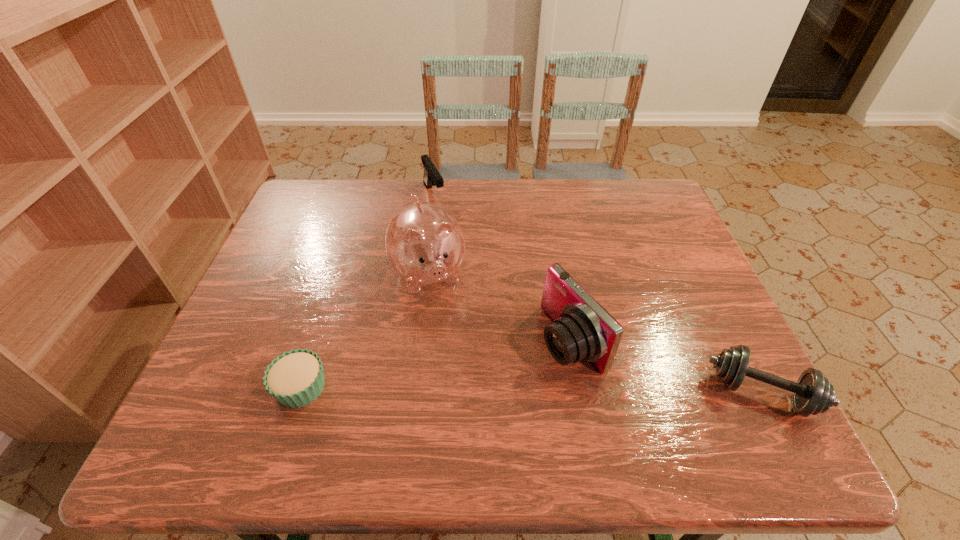
Identify the location of dumbbell present at the near edge. The image size is (960, 540). (x=812, y=393).

This screenshot has height=540, width=960. I want to click on camera that is at the near edge, so click(582, 330).

The image size is (960, 540). What are the coordinates of `object that is at the left edge` in the screenshot? It's located at (296, 378).

I want to click on object located in the right edge section of the desktop, so click(x=812, y=393).

Where is `object present at the near left corner`? object present at the near left corner is located at coordinates (296, 378).

The height and width of the screenshot is (540, 960). I want to click on object situated at the near right corner, so click(x=812, y=393).

In the image, there is a desktop. Where is `free space at the far edge`? free space at the far edge is located at coordinates (385, 198).

In the image, there is a desktop. Where is `vacant region at the near edge`? vacant region at the near edge is located at coordinates (387, 387).

The height and width of the screenshot is (540, 960). What are the coordinates of `vacant area at the left edge` in the screenshot? It's located at (288, 284).

You are a GUI agent. You are given a task and a screenshot of the screen. Output one action in this format:
    pyautogui.click(x=<x>, y=<y>)
    Task: Click on the vacant space at the right edge of the desktop
    This screenshot has height=540, width=960.
    Given the screenshot: What is the action you would take?
    pyautogui.click(x=679, y=267)